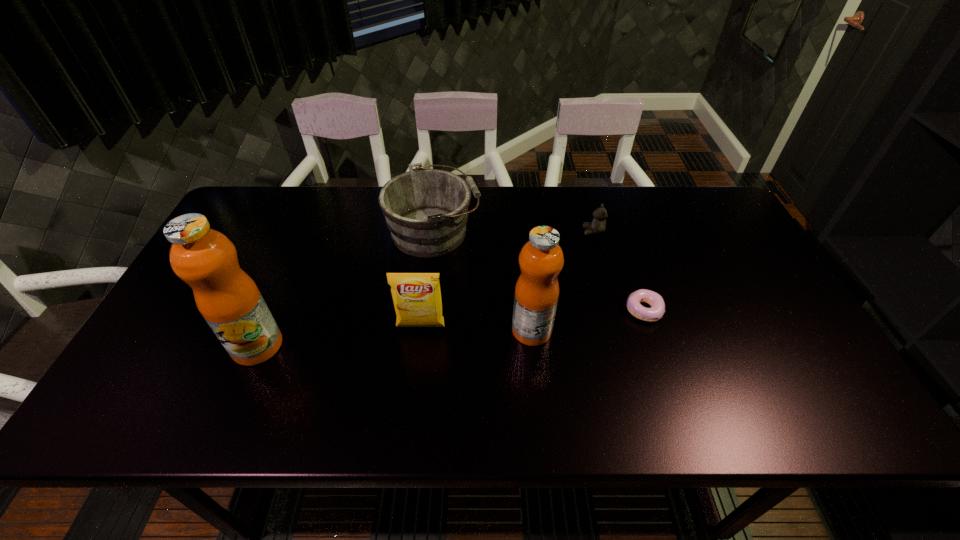
Locate an element on the screen. the left fruit juice is located at coordinates (227, 297).

Where is `the tallest object`? The image size is (960, 540). the tallest object is located at coordinates (227, 297).

Locate an element on the screen. The height and width of the screenshot is (540, 960). the shorter fruit juice is located at coordinates pos(541,259).

Identify the location of the fifth shortest object. (541, 259).

Where is `teddy bear`? The width and height of the screenshot is (960, 540). teddy bear is located at coordinates (598, 225).

Where is `the third shortest object`? The width and height of the screenshot is (960, 540). the third shortest object is located at coordinates (426, 210).

Find the location of a particular element. the shortest object is located at coordinates (655, 313).

Where is `crisp (potato chip)`? This screenshot has height=540, width=960. crisp (potato chip) is located at coordinates (417, 300).

The width and height of the screenshot is (960, 540). What are the coordinates of `vacant space located 0.090m on the left of the left fruit juice` in the screenshot? It's located at (195, 346).

Locate an element on the screen. The width and height of the screenshot is (960, 540). free point located 0.230m on the back of the fourth object from left to right is located at coordinates (524, 254).